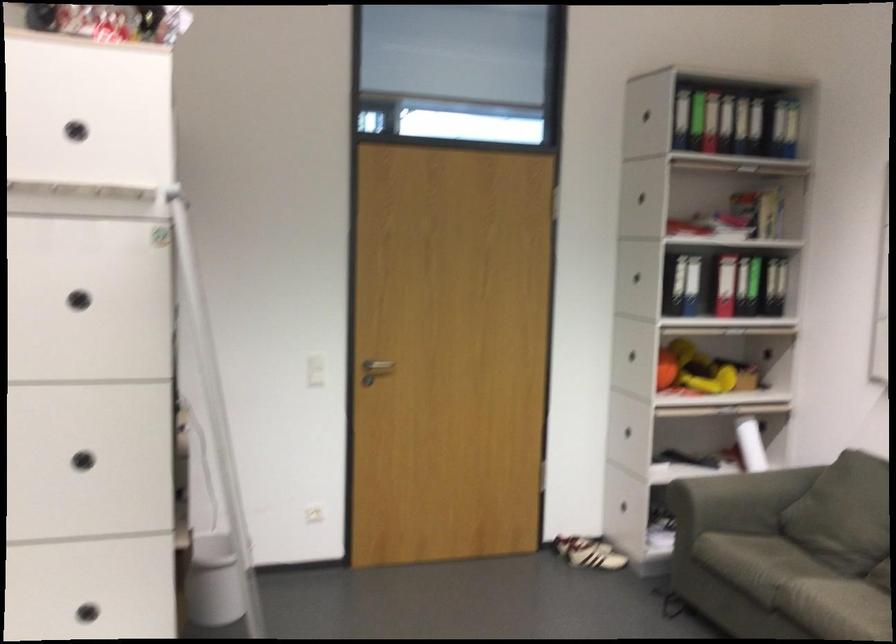
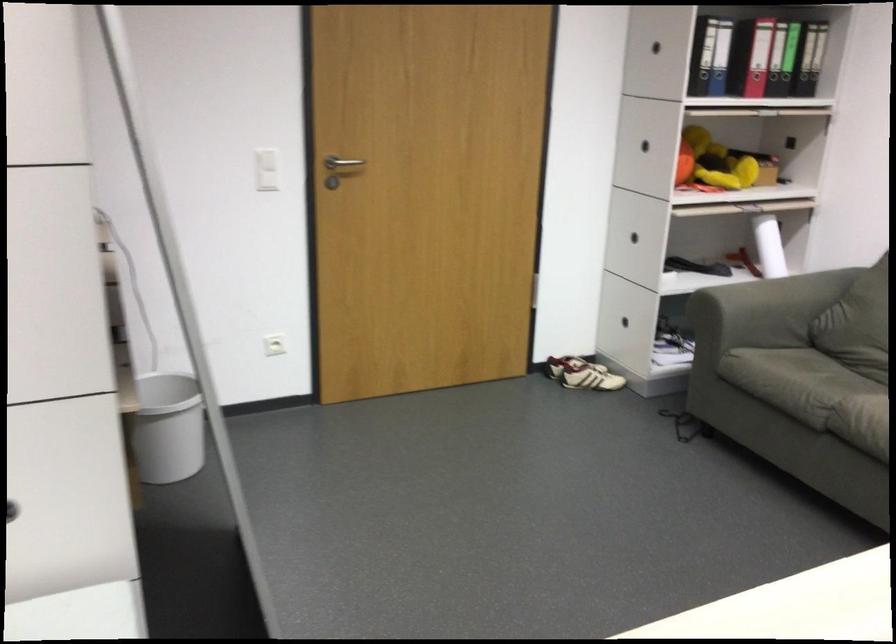
Question: Based on the continuous images, in which direction is the camera rotating? Reply with the corresponding letter.

Choices:
 (A) Left
 (B) Right
 (C) Up
 (D) Down

Answer: (D)